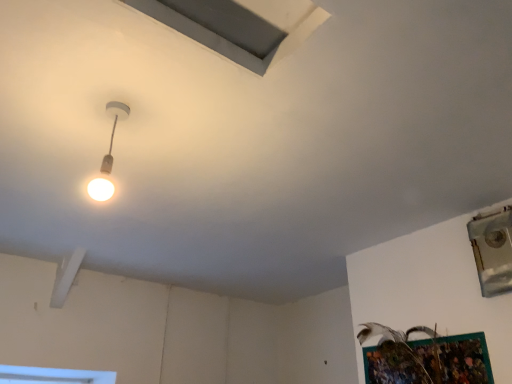
Question: Considering the positions of point (501, 246) and point (117, 117), is point (501, 246) closer or farther from the camera than point (117, 117)?

Choices:
 (A) farther
 (B) closer

Answer: (A)

Question: From the image's perspective, is metallic silver window at upper right located above or below matte white lamp at upper left?

Choices:
 (A) below
 (B) above

Answer: (A)

Question: Considering the real-world distances, which object is farthest from the gray matte exhaust hood at upper center?

Choices:
 (A) metallic silver window at upper right
 (B) matte white lamp at upper left

Answer: (A)

Question: Considering the real-world distances, which object is farthest from the gray matte exhaust hood at upper center?

Choices:
 (A) metallic silver window at upper right
 (B) matte white lamp at upper left

Answer: (A)